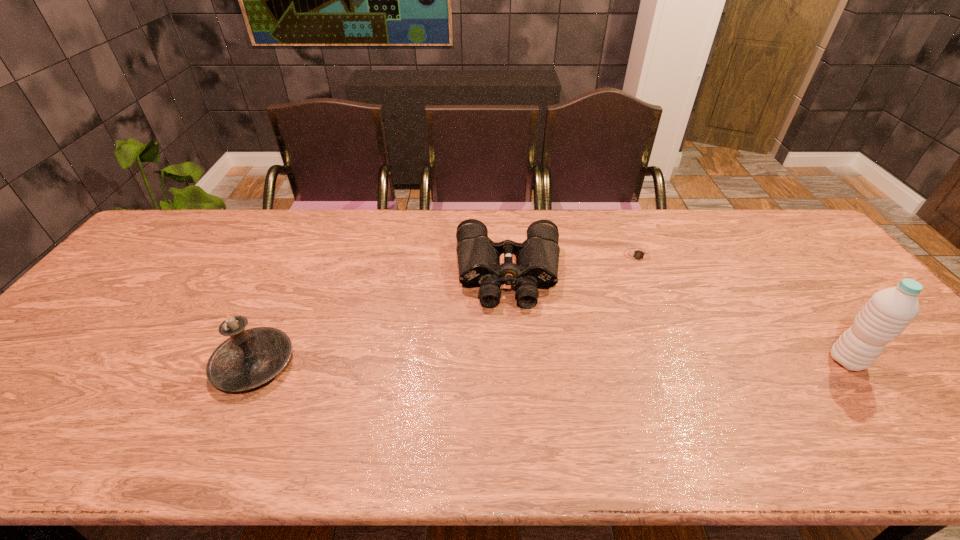
The height and width of the screenshot is (540, 960). What are the coordinates of `free point at the far edge` in the screenshot? It's located at (673, 233).

In the image, there is a desktop. Identify the location of vacant space at the near edge. (560, 407).

Locate an element on the screen. vacant space at the right edge of the desktop is located at coordinates (855, 304).

Where is `free space at the far left corner`? free space at the far left corner is located at coordinates (180, 215).

You are a GUI agent. You are given a task and a screenshot of the screen. Output one action in this format:
    pyautogui.click(x=<x>, y=<y>)
    Task: Click on the vacant space at the far right corner of the desktop
    
    Given the screenshot: What is the action you would take?
    pyautogui.click(x=765, y=218)

At what (x,y) coordinates should I click in order to perform the action: click on free point between the second tallest object and the water bottle. Please return your answer as a coordinate pair (x, y). Looking at the image, I should click on (550, 362).

This screenshot has width=960, height=540. I want to click on vacant area that lies between the leftmost object and the shortest object, so click(446, 309).

Locate an element on the screen. Image resolution: width=960 pixels, height=540 pixels. free space between the candle and the binoculars is located at coordinates (381, 319).

The height and width of the screenshot is (540, 960). Find the location of `free space between the water bottle and the second object from left to right`. free space between the water bottle and the second object from left to right is located at coordinates (678, 318).

Find the location of `vacant space that is in between the second tallest object and the shortest object`. vacant space that is in between the second tallest object and the shortest object is located at coordinates (446, 309).